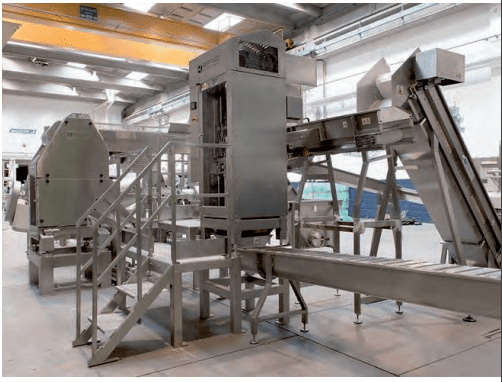
Where is `white wall`? The width and height of the screenshot is (502, 382). white wall is located at coordinates (21, 116).